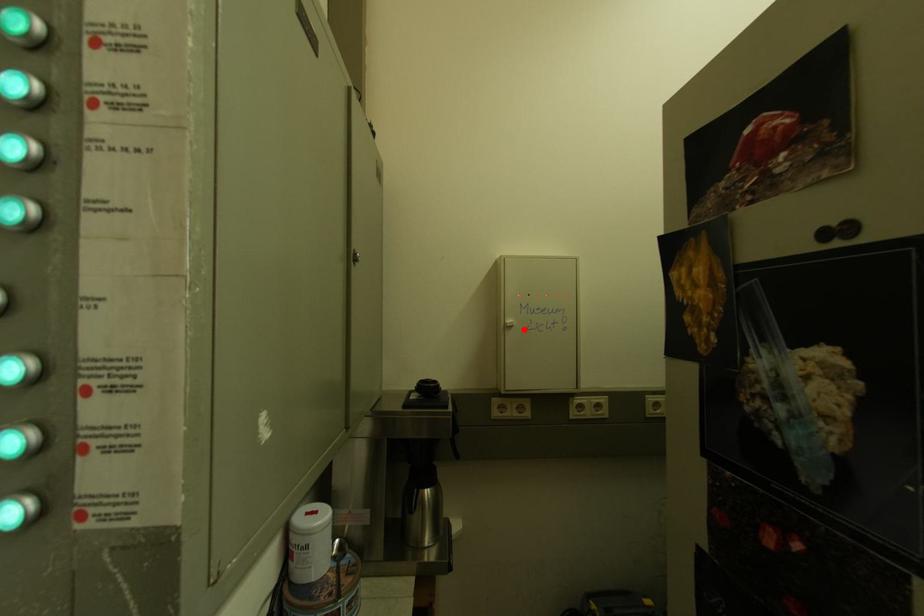
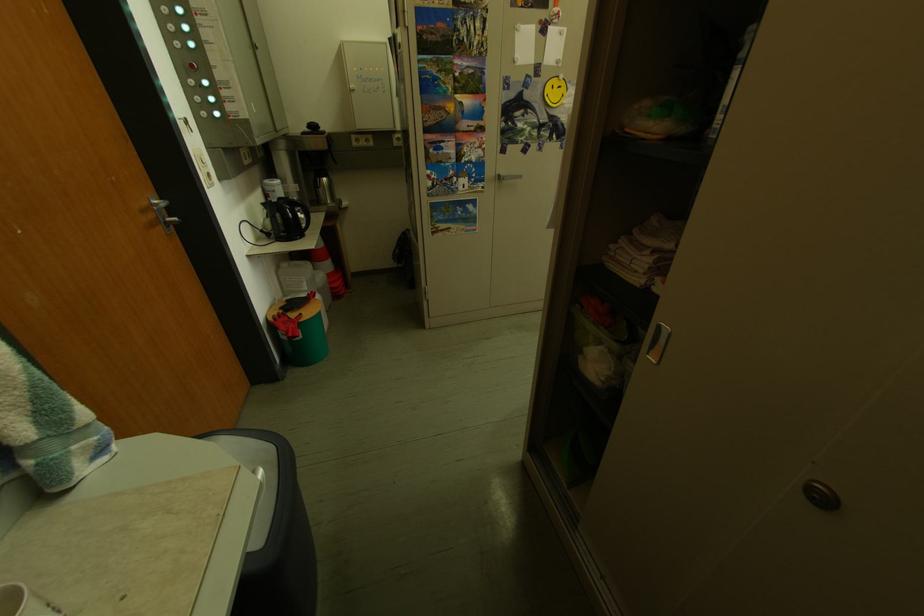
Question: I am providing you with two images of the same scene from different viewpoints. A red point is shown in image1. For the corresponding object point in image2, is it positioned nearer or farther from the camera?

Choices:
 (A) Nearer
 (B) Farther

Answer: (A)